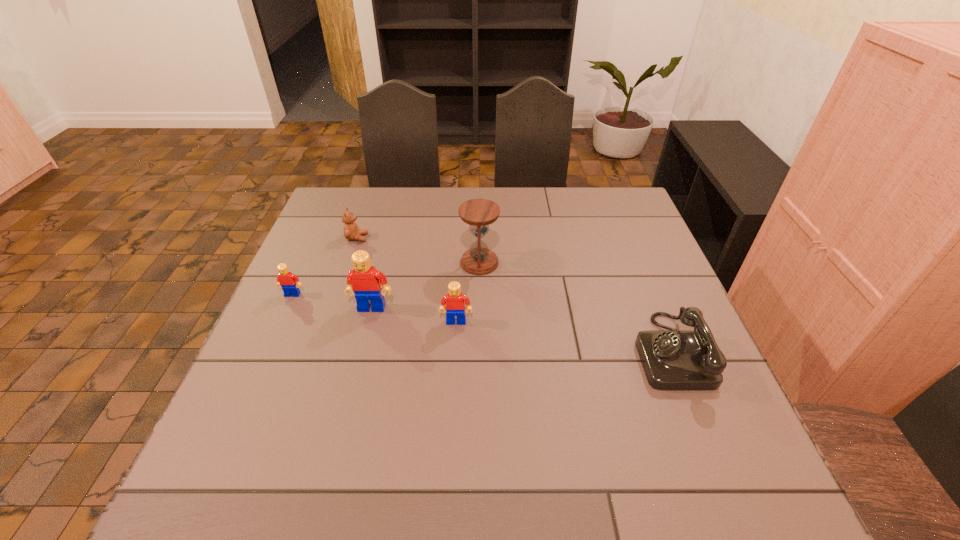
In order to click on unoccupied position between the telephone and the second object from left to right in this screenshot , I will do `click(514, 294)`.

Identify the location of unoccupied position between the second shortest Lego and the teddy bear. (407, 280).

Where is `empty space that is in between the leftmost object and the rightmost object`? Image resolution: width=960 pixels, height=540 pixels. empty space that is in between the leftmost object and the rightmost object is located at coordinates (481, 323).

The width and height of the screenshot is (960, 540). Identify the location of empty location between the leftmost Lego and the farthest object. tap(324, 266).

Locate an element on the screen. free area in between the tallest Lego and the rightmost object is located at coordinates [521, 329].

Find the location of a particular element. free point between the second tallest Lego and the telephone is located at coordinates (564, 336).

In order to click on object that is the fourth nearest to the second shortest Lego in this screenshot , I will do `click(351, 232)`.

Select which object is the closest to the second object from left to right. Please provide its 2D coordinates. Your answer should be formatted as a tuple, i.e. [(x, y)], where the tuple contains the x and y coordinates of a point satisfying the conditions above.

[(285, 278)]

Choose which Lego is the nearest neighbor to the second Lego from left to right. Please provide its 2D coordinates. Your answer should be formatted as a tuple, i.e. [(x, y)], where the tuple contains the x and y coordinates of a point satisfying the conditions above.

[(455, 301)]

At what (x,y) coordinates should I click in order to perform the action: click on Lego that can be found as the closest to the telephone. Please return your answer as a coordinate pair (x, y). The height and width of the screenshot is (540, 960). Looking at the image, I should click on (455, 301).